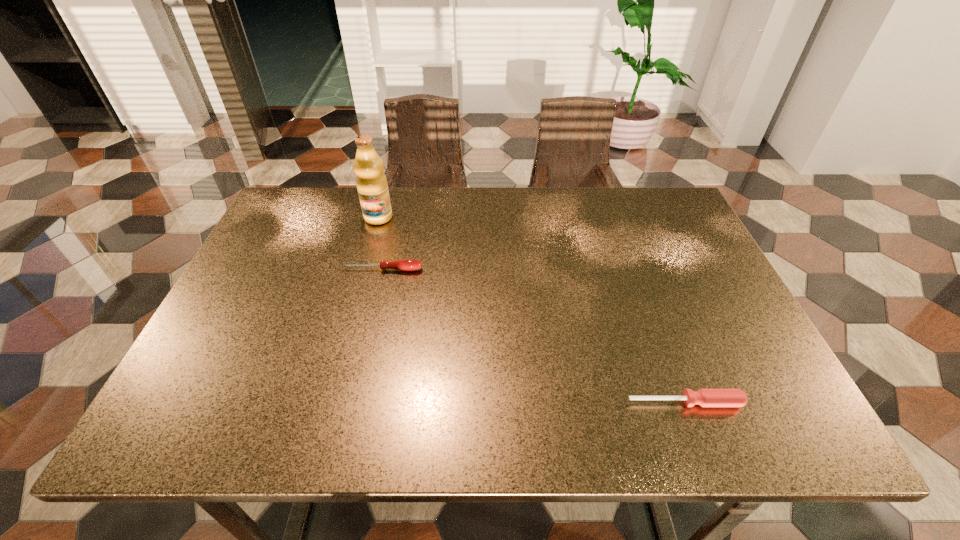
This screenshot has height=540, width=960. I want to click on the tallest object, so click(371, 182).

The width and height of the screenshot is (960, 540). I want to click on the farthest object, so click(371, 182).

The height and width of the screenshot is (540, 960). I want to click on the left screwdriver, so click(404, 264).

Identify the location of the farther screwdriver. (404, 264).

Identify the location of the nearer screwdriver. This screenshot has width=960, height=540. (704, 397).

Where is `the rightmost object`? The image size is (960, 540). the rightmost object is located at coordinates (704, 397).

This screenshot has width=960, height=540. Find the location of `vacant area located on the front label of the tallest object`. vacant area located on the front label of the tallest object is located at coordinates (352, 312).

Identify the location of vacant area situated 0.350m on the front of the second nearest object. The image size is (960, 540). (353, 394).

This screenshot has width=960, height=540. What are the coordinates of `free space located on the back of the rightmost object` in the screenshot? It's located at (660, 333).

The image size is (960, 540). Find the location of `object that is at the far edge`. object that is at the far edge is located at coordinates (371, 182).